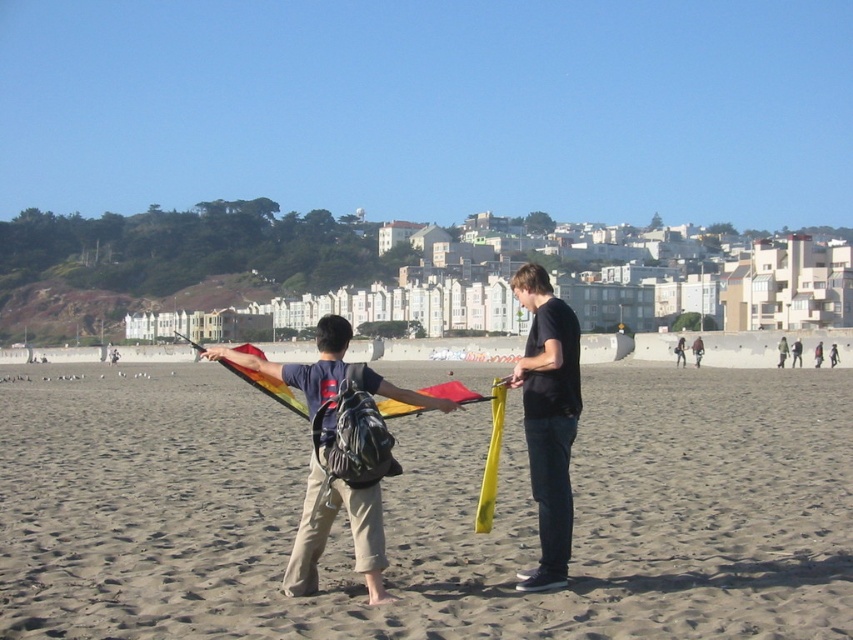
Does matte black shirt at center lie in front of rainbow fabric kite at center?

Yes, it is.

Can you confirm if matte black shirt at center is thinner than rainbow fabric kite at center?

Yes, matte black shirt at center is thinner than rainbow fabric kite at center.

Is point (538, 580) closer to camera compared to point (488, 506)?

Yes, it is.

Locate an element on the screen. This screenshot has height=640, width=853. matte black shirt at center is located at coordinates (548, 419).

Can you confirm if sandy beach at center is smaller than rainbow fabric kite at center?

Yes.

Is sandy beach at center closer to the viewer compared to rainbow fabric kite at center?

Yes.

What do you see at coordinates (426, 513) in the screenshot?
I see `sandy beach at center` at bounding box center [426, 513].

Image resolution: width=853 pixels, height=640 pixels. In order to click on sandy beach at center in this screenshot , I will do `click(426, 513)`.

Who is more forward, (355, 621) or (535, 362)?

Point (355, 621)

Which is more to the left, sandy beach at center or matte black shirt at center?

sandy beach at center

Which is behind, point (651, 440) or point (532, 339)?

Point (651, 440)

Where is `sandy beach at center`? The image size is (853, 640). sandy beach at center is located at coordinates (426, 513).